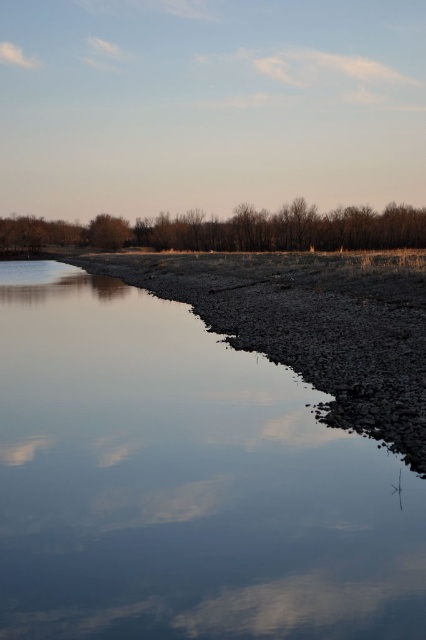
You are standing at the edge of the smooth reflective water at center and looking towards the brown textured trees at upper center. Which object is closer to you?

The smooth reflective water at center is closer to you since it is shorter than the brown textured trees at upper center, which are further away.

You are standing at the edge of the water and see two points marked in the scene. Which point, point (77, 608) or point (393, 225), is closer to you?

Point (77, 608) is closer to the camera than point (393, 225), so it is closer to you.